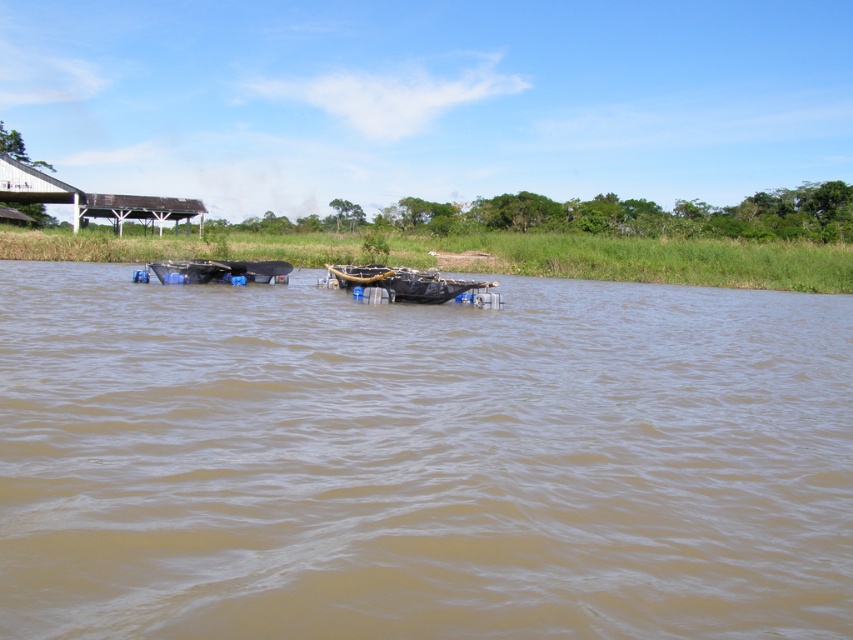
Between wooden boat at center and dark brown wooden boat at center, which one has more height?

wooden boat at center

Does wooden boat at center have a lesser height compared to dark brown wooden boat at center?

In fact, wooden boat at center may be taller than dark brown wooden boat at center.

Who is more distant from viewer, (407, 289) or (239, 266)?

Point (239, 266)

Locate an element on the screen. wooden boat at center is located at coordinates (404, 282).

Between brown muddy water at center and dark brown wooden boat at center, which one appears on the left side from the viewer's perspective?

dark brown wooden boat at center is more to the left.

Between brown muddy water at center and dark brown wooden boat at center, which one has more height?

brown muddy water at center is taller.

The image size is (853, 640). I want to click on brown muddy water at center, so [421, 460].

This screenshot has width=853, height=640. In order to click on brown muddy water at center in this screenshot , I will do `click(421, 460)`.

The image size is (853, 640). What do you see at coordinates (421, 460) in the screenshot?
I see `brown muddy water at center` at bounding box center [421, 460].

How distant is brown muddy water at center from wooden boat at center?

5.91 meters

Who is more distant from viewer, (618, 342) or (398, 273)?

Positioned behind is point (398, 273).

Find the location of a particular element. The height and width of the screenshot is (640, 853). brown muddy water at center is located at coordinates (421, 460).